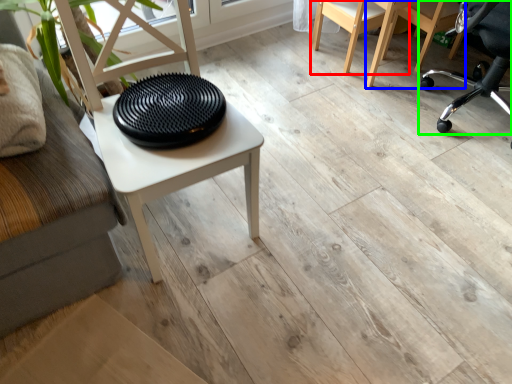
Question: Which object is positioned farthest from chair (highlighted by a red box)? Select from chair (highlighted by a blue box) and chair (highlighted by a green box).

Choices:
 (A) chair
 (B) chair

Answer: (B)